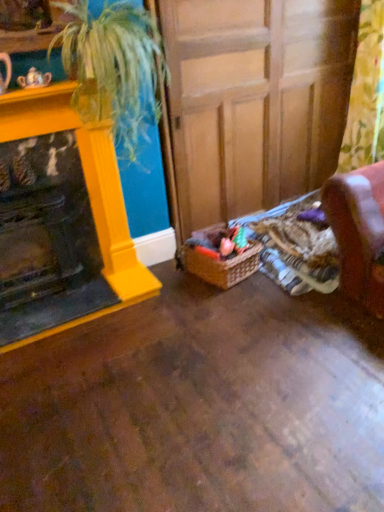
Identify the location of vacant space in front of matte yellow fireplace at left. (57, 313).